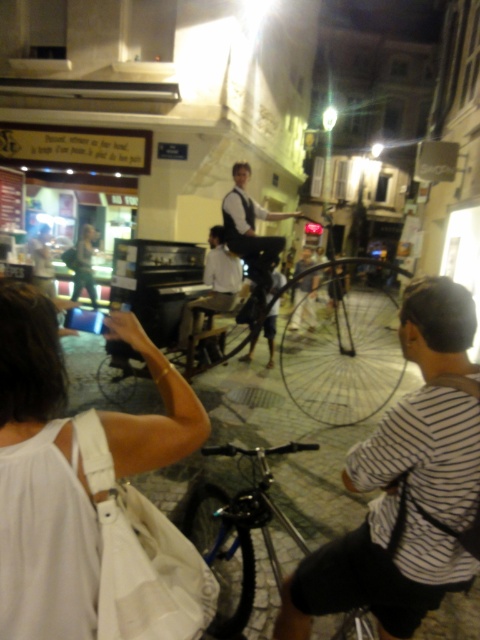
You are a photographer trying to capture the entire scene in one shot. Given that the blue metallic bicycle at center and the matte black dress at center are both in focus, which object would appear larger in your photo?

The blue metallic bicycle at center would appear larger in the photo since it is bigger than the matte black dress at center according to the description.

You are a delivery person trying to navigate through the narrow cobblestone street. You see the blue metallic bicycle at center and the matte black dress at center. Which object is closer to you as you approach the scene?

The blue metallic bicycle at center is closer to you because it is in front of the matte black dress at center.

You are a delivery person who needs to pass through the street between the blue metallic bicycle at center and the matte black dress at center. The delivery cart you are using is 1.8 meters tall. Can you safely pass through without hitting the top of your cart?

The blue metallic bicycle at center is not as tall as matte black dress at center. Since the bicycle is shorter than the dress, but the height of the dress itself is not specified, it is uncertain whether the delivery cart can pass safely. Please check the actual height of the objects on the street.